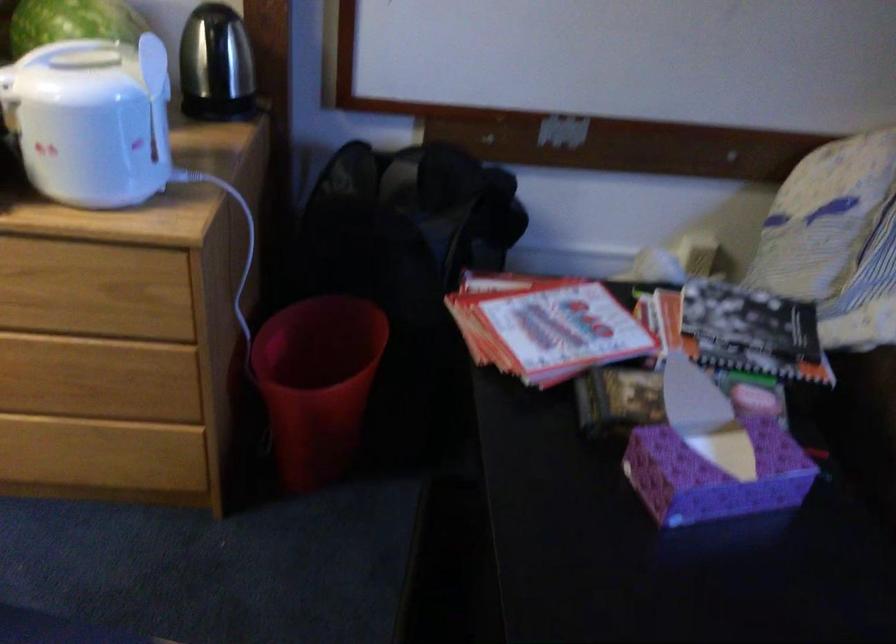
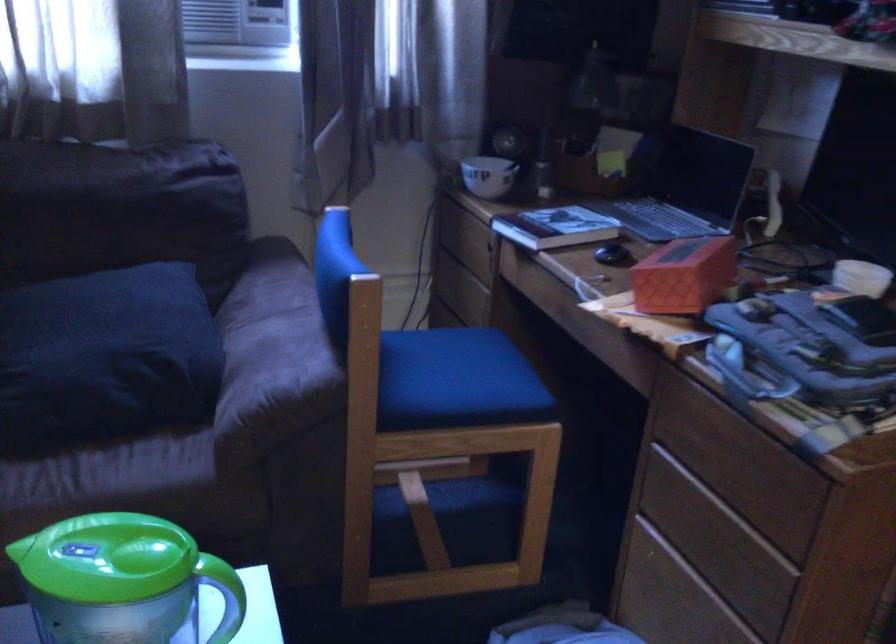
The first image is from the beginning of the video and the second image is from the end. How did the camera likely rotate when shooting the video?

The rotation direction of the camera is right-down.